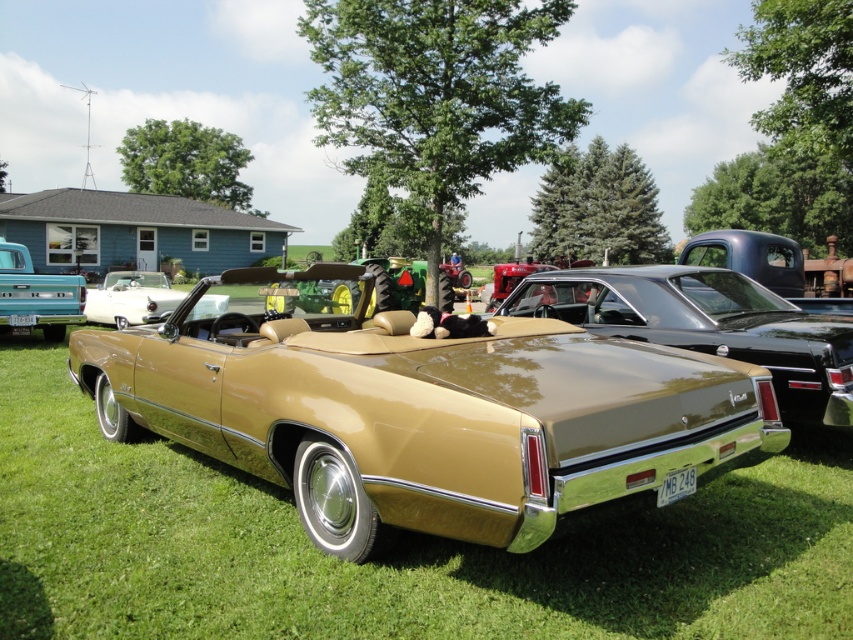
You are a photographer trying to capture both the gold glossy convertible at center and the gold matte car at center in a single wide shot. The camera you are using has a maximum focal length that allows capturing objects up to 3.5 meters apart. Will you be able to include both cars in the frame?

The gold glossy convertible at center and gold matte car at center are 3.60 meters apart from each other. Since the maximum distance your camera can capture is 3.5 meters, you will not be able to include both cars in the frame as the distance between them exceeds the camera capability.